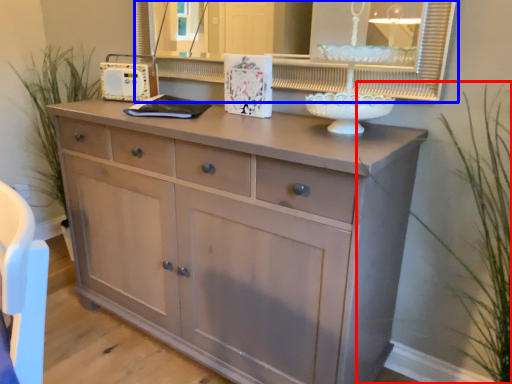
Question: Which of the following is the farthest to the observer, plant (highlighted by a red box) or medicine cabinet (highlighted by a blue box)?

Choices:
 (A) plant
 (B) medicine cabinet

Answer: (B)